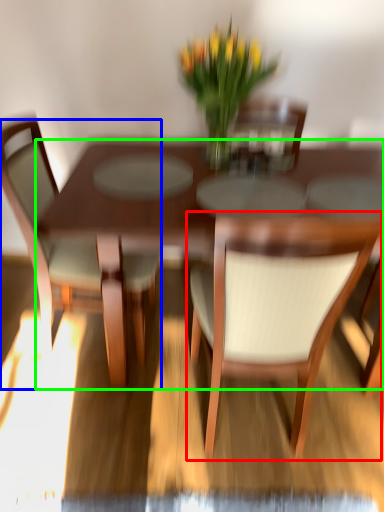
Question: Which is nearer to the chair (highlighted by a red box)? chair (highlighted by a blue box) or kitchen & dining room table (highlighted by a green box).

Choices:
 (A) chair
 (B) kitchen & dining room table

Answer: (B)